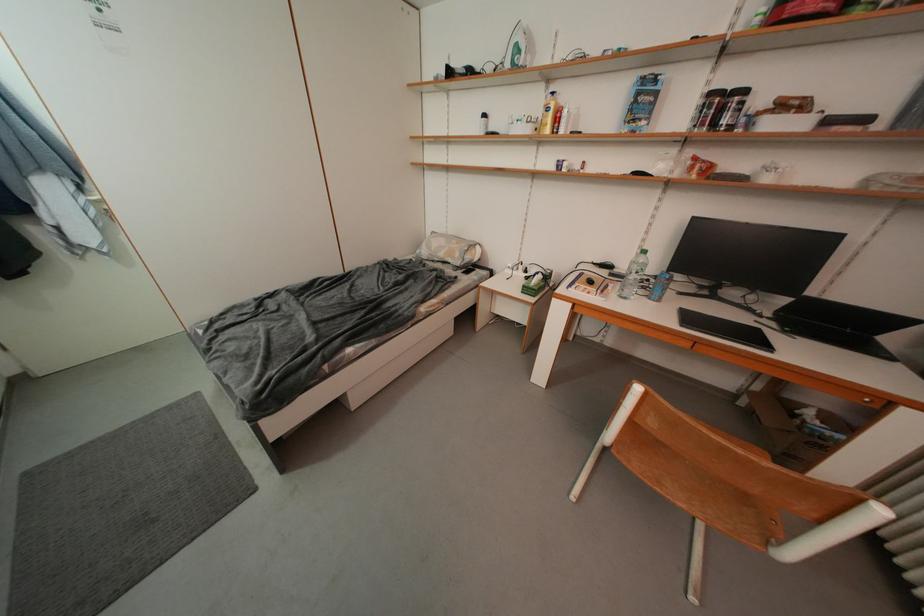
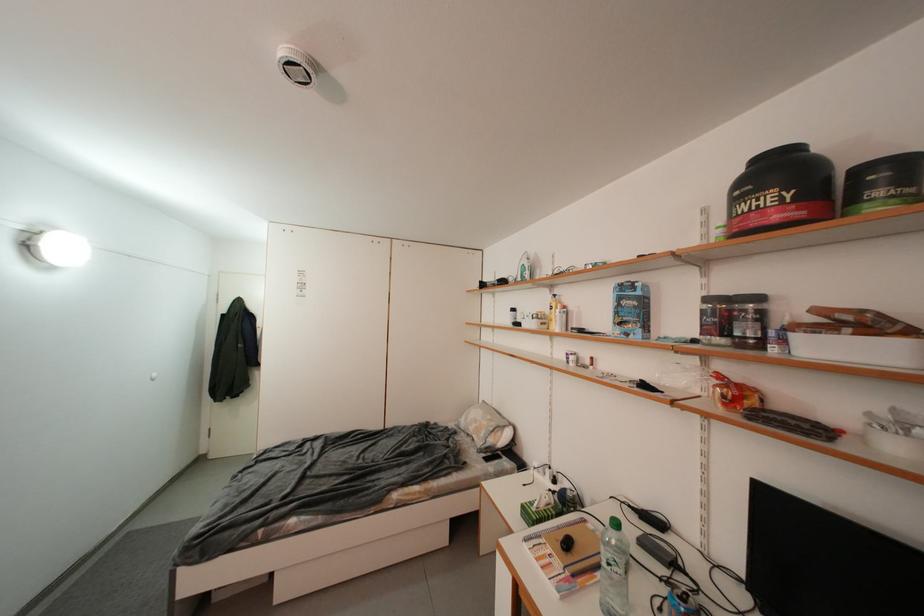
In the second image, find the point that corresponds to point (531, 290) in the first image.

(530, 509)